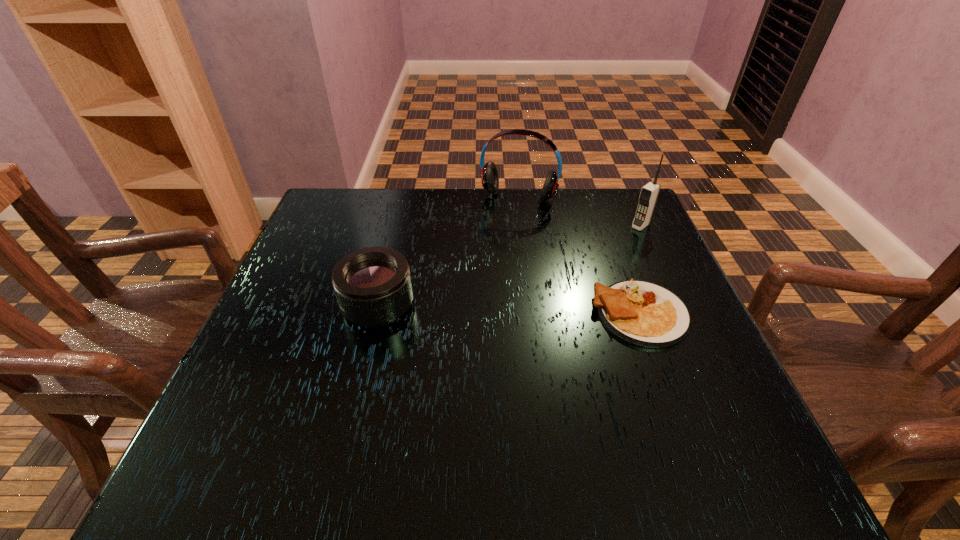
What are the coordinates of `vacant region located 0.260m with the microphone attached to the side of the second object from left to right` in the screenshot? It's located at (485, 293).

The image size is (960, 540). Find the location of `free space located 0.060m with the microphone attached to the side of the second object from left to right`. free space located 0.060m with the microphone attached to the side of the second object from left to right is located at coordinates (506, 239).

I want to click on vacant area located 0.180m on the front-facing side of the cellular telephone, so click(596, 261).

Image resolution: width=960 pixels, height=540 pixels. Find the location of `vacant space positioned on the front-facing side of the cellular telephone`. vacant space positioned on the front-facing side of the cellular telephone is located at coordinates (548, 300).

Where is `vacant point located on the front-facing side of the cellular telephone`? The height and width of the screenshot is (540, 960). vacant point located on the front-facing side of the cellular telephone is located at coordinates (610, 251).

This screenshot has width=960, height=540. I want to click on headset that is at the far edge, so click(489, 175).

Identify the location of cellular telephone that is at the far edge. Image resolution: width=960 pixels, height=540 pixels. (649, 193).

The height and width of the screenshot is (540, 960). I want to click on object present at the left edge, so click(x=373, y=287).

Locate an element on the screen. The width and height of the screenshot is (960, 540). omelet located in the right edge section of the desktop is located at coordinates (642, 313).

I want to click on cellular telephone located in the right edge section of the desktop, so click(x=649, y=193).